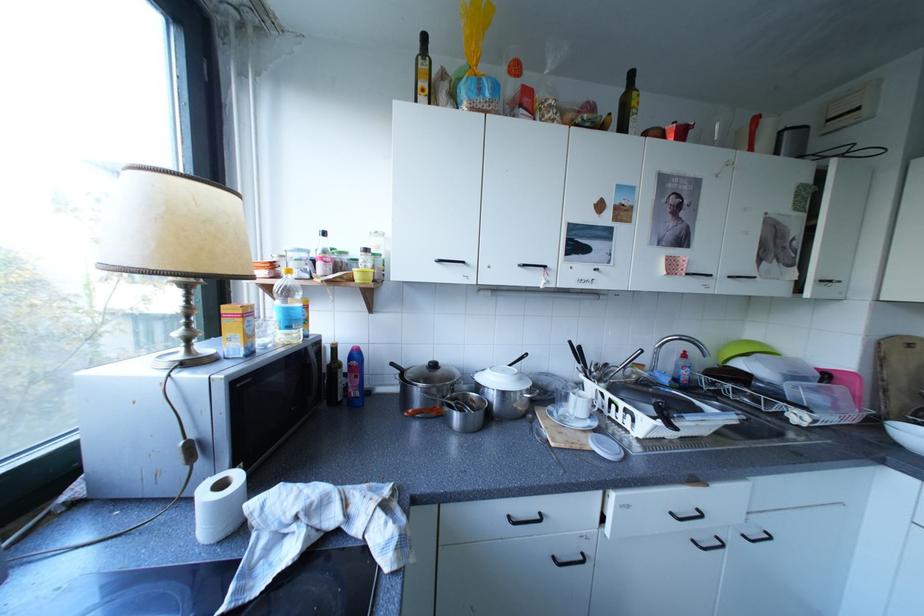
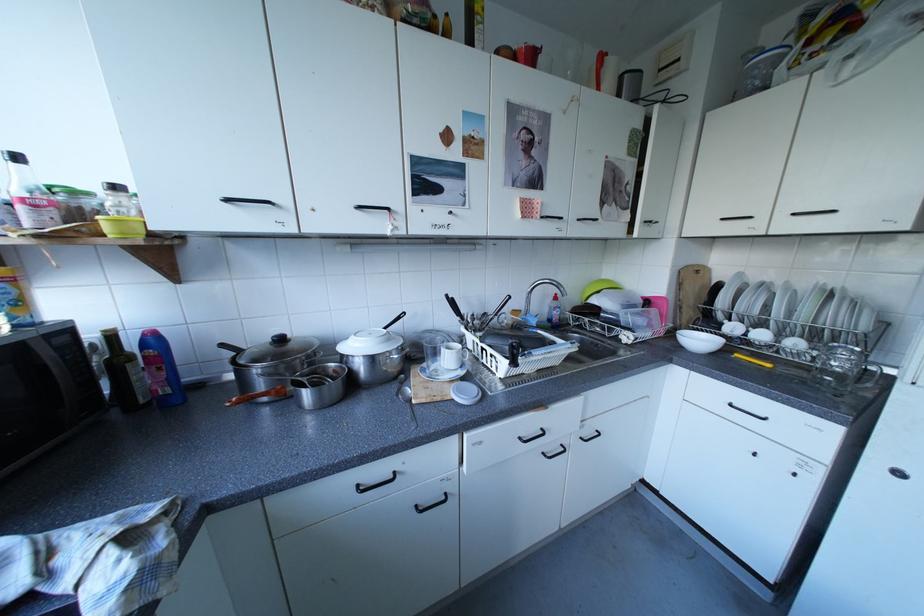
Where in the second image is the point corresponding to (x=586, y=395) from the first image?

(456, 349)